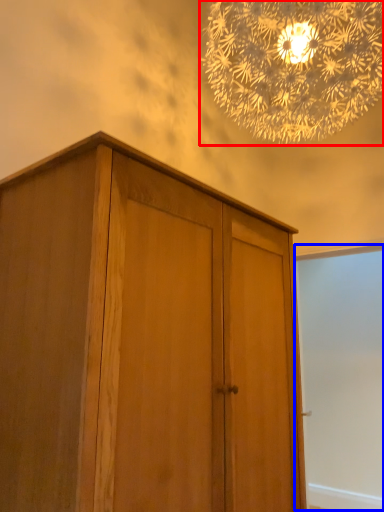
Question: Which object appears farthest to the camera in this image, lamp (highlighted by a red box) or screen door (highlighted by a blue box)?

Choices:
 (A) lamp
 (B) screen door

Answer: (B)